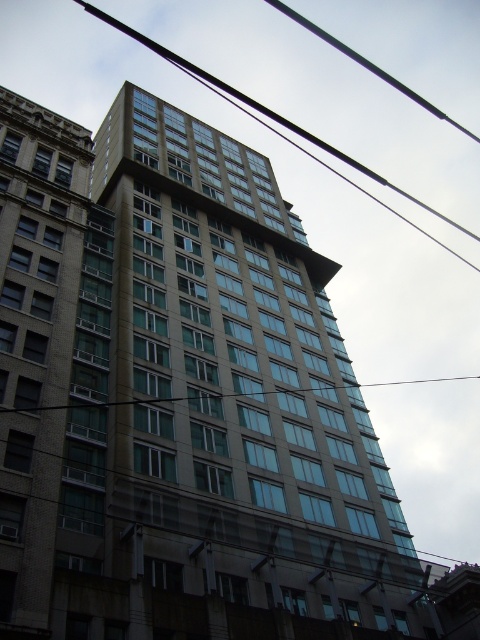
Between brown brick building at left and metallic wire at upper center, which one has less height?

brown brick building at left is shorter.

Who is lower down, brown brick building at left or metallic wire at upper center?

Positioned lower is brown brick building at left.

Image resolution: width=480 pixels, height=640 pixels. Find the location of `brown brick building at left`. brown brick building at left is located at coordinates (38, 248).

The width and height of the screenshot is (480, 640). Identify the location of brown brick building at left. (38, 248).

Does metallic wire at upper center appear under transparent glass power line at center?

No.

Who is positioned more to the right, metallic wire at upper center or transparent glass power line at center?

From the viewer's perspective, transparent glass power line at center appears more on the right side.

This screenshot has height=640, width=480. Describe the element at coordinates (273, 120) in the screenshot. I see `metallic wire at upper center` at that location.

Where is `metallic wire at upper center`? The width and height of the screenshot is (480, 640). metallic wire at upper center is located at coordinates (273, 120).

Image resolution: width=480 pixels, height=640 pixels. What do you see at coordinates (38, 248) in the screenshot?
I see `brown brick building at left` at bounding box center [38, 248].

Which is above, brown brick building at left or transparent glass power line at center?

brown brick building at left

Does point (58, 467) come farther from viewer compared to point (462, 380)?

No, it is not.

This screenshot has height=640, width=480. Identify the location of brown brick building at left. (38, 248).